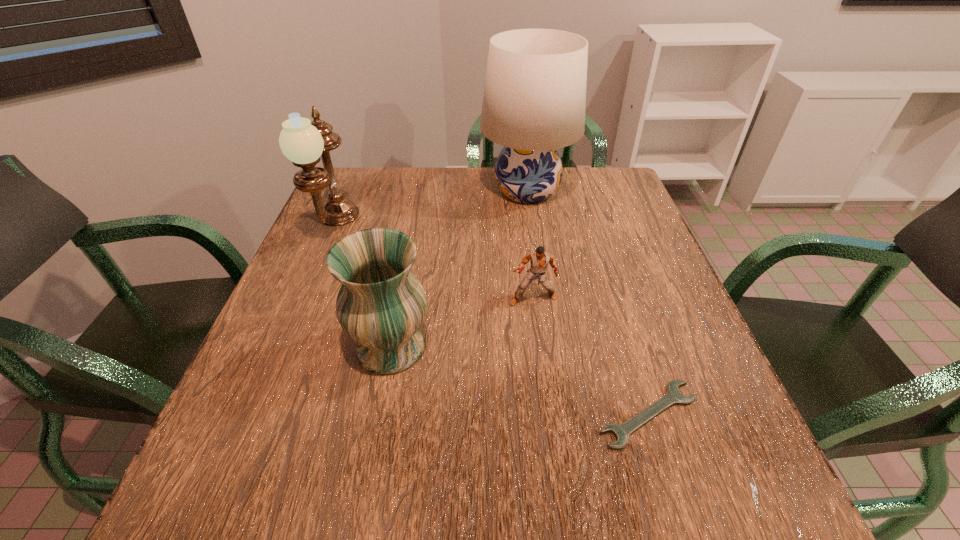
At what (x,y) coordinates should I click in order to perform the action: click on vacant space that is in between the second object from left to right and the shortest object. Please return your answer as a coordinate pair (x, y). The image size is (960, 540). Looking at the image, I should click on (520, 381).

Locate an element on the screen. vacant area that lies between the vase and the lampshade is located at coordinates (459, 269).

Image resolution: width=960 pixels, height=540 pixels. In order to click on vacant area that lies between the nearest object and the leftmost object in this screenshot , I will do `click(492, 321)`.

Image resolution: width=960 pixels, height=540 pixels. I want to click on free area in between the third farthest object and the fourth object from right to left, so click(462, 323).

Locate an element on the screen. The image size is (960, 540). free space between the third tallest object and the wrench is located at coordinates (520, 381).

Image resolution: width=960 pixels, height=540 pixels. In order to click on free point between the puncher and the leftmost object in this screenshot , I will do (434, 263).

Find the location of a particular element. vacant area that lies between the second shortest object and the oil lamp is located at coordinates (434, 263).

The height and width of the screenshot is (540, 960). What are the coordinates of `object that is the fourth nearest to the second tallest object` in the screenshot? It's located at (673, 396).

Select which object appears as the fourth closest to the tallest object. Please provide its 2D coordinates. Your answer should be formatted as a tuple, i.e. [(x, y)], where the tuple contains the x and y coordinates of a point satisfying the conditions above.

[(673, 396)]

Find the location of a particular element. The width and height of the screenshot is (960, 540). vacant region that satisfies the following two spatial constraints: 1. on the front-facing side of the tallest object; 2. on the front-facing side of the second shortest object is located at coordinates (542, 299).